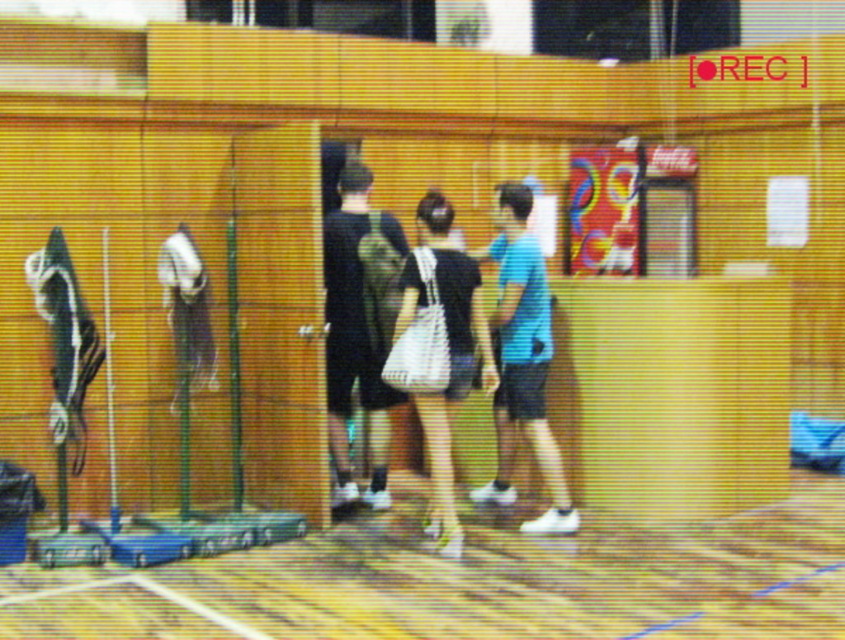
Can you confirm if yellow rubber court at center is thinner than blue matte shirt at center?

No.

Who is positioned more to the left, yellow rubber court at center or blue matte shirt at center?

yellow rubber court at center is more to the left.

Between point (609, 532) and point (548, 310), which one is positioned behind?

The point (548, 310) is more distant.

Identify the location of yellow rubber court at center. The width and height of the screenshot is (845, 640). (472, 582).

Between dark green fabric backpack at center and black matte bag at center, which one is positioned higher?

dark green fabric backpack at center is higher up.

Which is behind, point (350, 477) or point (470, 316)?

The point (350, 477) is more distant.

Is point (391, 300) farther from viewer compared to point (455, 554)?

That is True.

This screenshot has width=845, height=640. Identify the location of dark green fabric backpack at center. (360, 326).

Does yellow rubber court at center lie in front of black matte bag at center?

That is True.

Can you confirm if yellow rubber court at center is positioned to the left of black matte bag at center?

No, yellow rubber court at center is not to the left of black matte bag at center.

At what (x,y) coordinates should I click in order to perform the action: click on yellow rubber court at center. Please return your answer as a coordinate pair (x, y). The width and height of the screenshot is (845, 640). Looking at the image, I should click on 472,582.